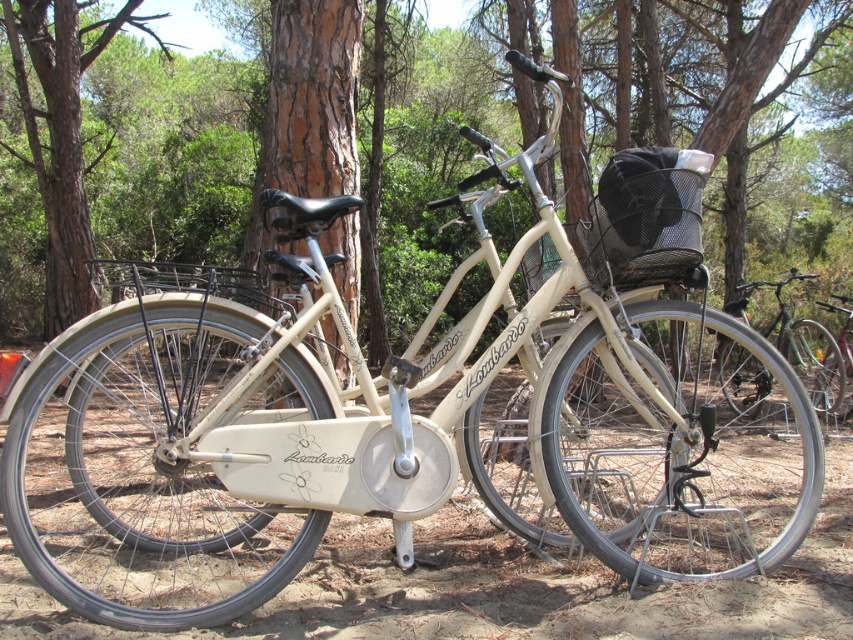
Question: Can you confirm if shiny silver bicycle at center is thinner than metallic silver bicycle at center?

Choices:
 (A) yes
 (B) no

Answer: (A)

Question: Among these objects, which one is nearest to the camera?

Choices:
 (A) metallic silver bicycle at center
 (B) shiny silver bicycle at center

Answer: (B)

Question: Which point appears farthest from the camera in this image?

Choices:
 (A) [x=846, y=336]
 (B) [x=831, y=403]

Answer: (A)

Question: Can you confirm if shiny silver bicycle at center is positioned above metallic silver bicycle at center?

Choices:
 (A) no
 (B) yes

Answer: (B)

Question: Which of the following is the farthest from the observer?

Choices:
 (A) metallic silver bicycle at center
 (B) shiny silver bicycle at center

Answer: (A)

Question: Can you confirm if shiny silver bicycle at center is thinner than metallic silver bicycle at center?

Choices:
 (A) no
 (B) yes

Answer: (B)